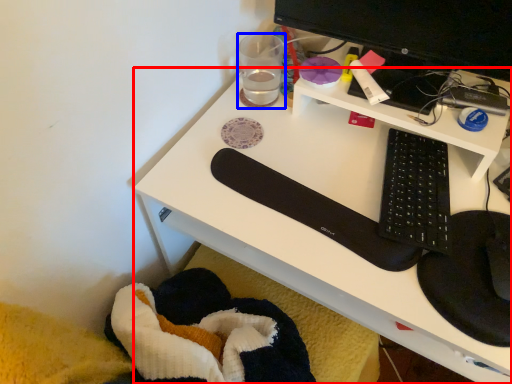
Question: Among these objects, which one is farthest to the camera, desk (highlighted by a red box) or stationery (highlighted by a blue box)?

Choices:
 (A) desk
 (B) stationery

Answer: (B)